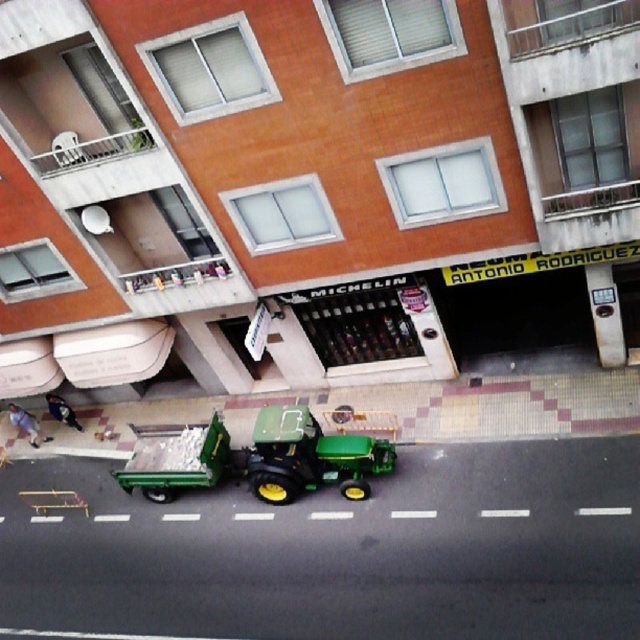
Can you confirm if light blue jeans at lower left is wider than dark blue jeans at lower left?

Yes, light blue jeans at lower left is wider than dark blue jeans at lower left.

Can you confirm if light blue jeans at lower left is bigger than dark blue jeans at lower left?

Yes.

Measure the distance between point (12, 403) and camera.

Point (12, 403) and camera are 21.40 meters apart from each other.

Find the location of a particular element. light blue jeans at lower left is located at coordinates (24, 422).

In the scene shown: Does green rubber tractor at center appear over light blue jeans at lower left?

Yes.

Is green rubber tractor at center taller than light blue jeans at lower left?

Indeed, green rubber tractor at center has a greater height compared to light blue jeans at lower left.

The height and width of the screenshot is (640, 640). Identify the location of green rubber tractor at center. (310, 456).

Between green rubber tractor at center and green rubber tractor at lower center, which one has less height?

Standing shorter between the two is green rubber tractor at lower center.

Is the position of green rubber tractor at center less distant than that of green rubber tractor at lower center?

Yes, it is in front of green rubber tractor at lower center.

Is point (284, 458) closer to viewer compared to point (150, 472)?

Yes, it is.

Locate an element on the screen. green rubber tractor at center is located at coordinates (310, 456).